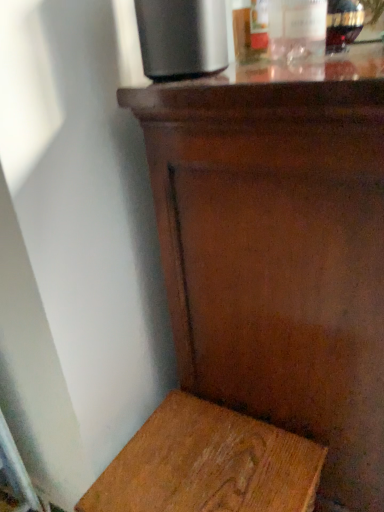
Question: Does clear glass bottle at upper right, marked as the 2th bottle in a right-to-left arrangement, appear on the left side of wooden stool at lower left?

Choices:
 (A) yes
 (B) no

Answer: (B)

Question: Considering the relative sizes of clear glass bottle at upper right, marked as the 2th bottle in a right-to-left arrangement, and wooden stool at lower left in the image provided, is clear glass bottle at upper right, marked as the 2th bottle in a right-to-left arrangement, thinner than wooden stool at lower left?

Choices:
 (A) yes
 (B) no

Answer: (A)

Question: Can you confirm if clear glass bottle at upper right, marked as the first bottle in a left-to-right arrangement, is smaller than wooden stool at lower left?

Choices:
 (A) no
 (B) yes

Answer: (B)

Question: From a real-world perspective, is clear glass bottle at upper right, marked as the first bottle in a left-to-right arrangement, under wooden stool at lower left?

Choices:
 (A) no
 (B) yes

Answer: (A)

Question: Does clear glass bottle at upper right, marked as the 2th bottle in a right-to-left arrangement, have a greater height compared to wooden stool at lower left?

Choices:
 (A) no
 (B) yes

Answer: (A)

Question: Is translucent glass bottle at upper right, which ranks as the second bottle in left-to-right order, inside the boundaries of clear glass bottle at upper right, marked as the 2th bottle in a right-to-left arrangement, or outside?

Choices:
 (A) outside
 (B) inside

Answer: (A)

Question: Considering their positions, is translucent glass bottle at upper right, which ranks as the second bottle in left-to-right order, located in front of or behind clear glass bottle at upper right, marked as the first bottle in a left-to-right arrangement?

Choices:
 (A) behind
 (B) front

Answer: (A)

Question: Considering the positions of translucent glass bottle at upper right, which ranks as the second bottle in left-to-right order, and clear glass bottle at upper right, marked as the 2th bottle in a right-to-left arrangement, in the image, is translucent glass bottle at upper right, which ranks as the second bottle in left-to-right order, bigger or smaller than clear glass bottle at upper right, marked as the 2th bottle in a right-to-left arrangement,?

Choices:
 (A) big
 (B) small

Answer: (B)

Question: Based on their positions, is translucent glass bottle at upper right, the 1th bottle when ordered from right to left, located to the left or right of clear glass bottle at upper right, marked as the first bottle in a left-to-right arrangement?

Choices:
 (A) left
 (B) right

Answer: (B)

Question: From a real-world perspective, is clear glass bottle at upper right, marked as the first bottle in a left-to-right arrangement, physically located above or below translucent glass bottle at upper right, the 1th bottle when ordered from right to left?

Choices:
 (A) above
 (B) below

Answer: (A)

Question: In the image, is clear glass bottle at upper right, marked as the first bottle in a left-to-right arrangement, on the left side or the right side of translucent glass bottle at upper right, the 1th bottle when ordered from right to left?

Choices:
 (A) right
 (B) left

Answer: (B)

Question: Do you think clear glass bottle at upper right, marked as the first bottle in a left-to-right arrangement, is within translucent glass bottle at upper right, the 1th bottle when ordered from right to left, or outside of it?

Choices:
 (A) inside
 (B) outside

Answer: (B)

Question: Looking at the image, does clear glass bottle at upper right, marked as the 2th bottle in a right-to-left arrangement, seem bigger or smaller compared to translucent glass bottle at upper right, the 1th bottle when ordered from right to left?

Choices:
 (A) small
 (B) big

Answer: (B)

Question: Is wooden stool at lower left bigger or smaller than shiny brown wood table at center?

Choices:
 (A) big
 (B) small

Answer: (B)

Question: From the image's perspective, is wooden stool at lower left located above or below shiny brown wood table at center?

Choices:
 (A) above
 (B) below

Answer: (B)